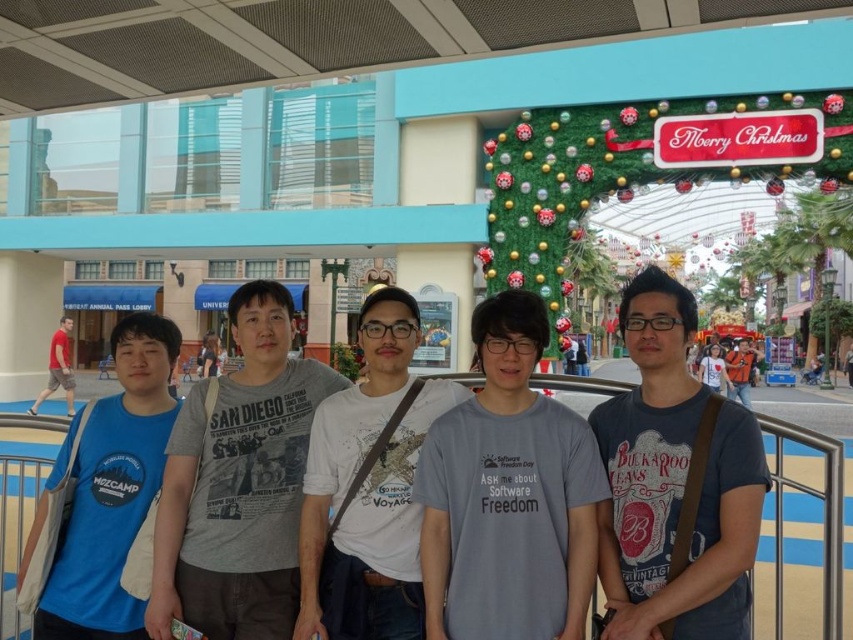
Question: Which object is farther from the camera taking this photo?

Choices:
 (A) red cotton t-shirt at left
 (B) green artificial grass at upper center
 (C) dark blue t-shirt at center

Answer: (A)

Question: Is gray printed t-shirt at center to the left of dark blue t-shirt at center from the viewer's perspective?

Choices:
 (A) no
 (B) yes

Answer: (B)

Question: Among these objects, which one is nearest to the camera?

Choices:
 (A) dark blue t-shirt at center
 (B) white cotton t-shirt at center

Answer: (A)

Question: Which object is the closest to the gray printed t-shirt at center?

Choices:
 (A) green artificial grass at upper center
 (B) dark blue t-shirt at center
 (C) gray cotton t-shirt at center
 (D) blue cotton t-shirt at left

Answer: (D)

Question: Is green artificial grass at upper center thinner than white cotton t-shirt at center?

Choices:
 (A) yes
 (B) no

Answer: (B)

Question: Is gray cotton t-shirt at center to the left of blue cotton t-shirt at left from the viewer's perspective?

Choices:
 (A) yes
 (B) no

Answer: (B)